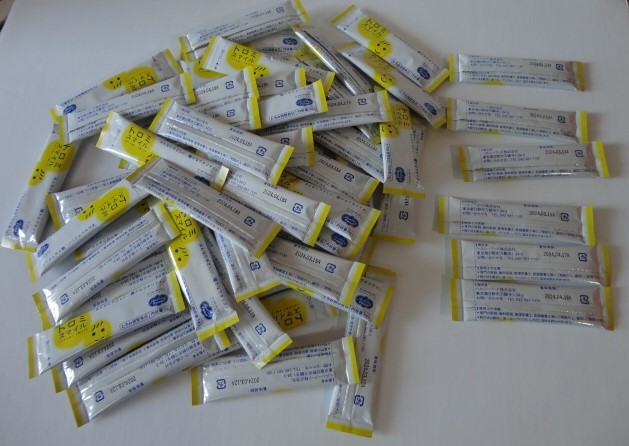
At what (x,y) coordinates should I click in order to perform the action: click on white surface. Please return your answer as a coordinate pair (x, y). Looking at the image, I should click on (46, 53), (428, 352), (494, 20), (156, 411).